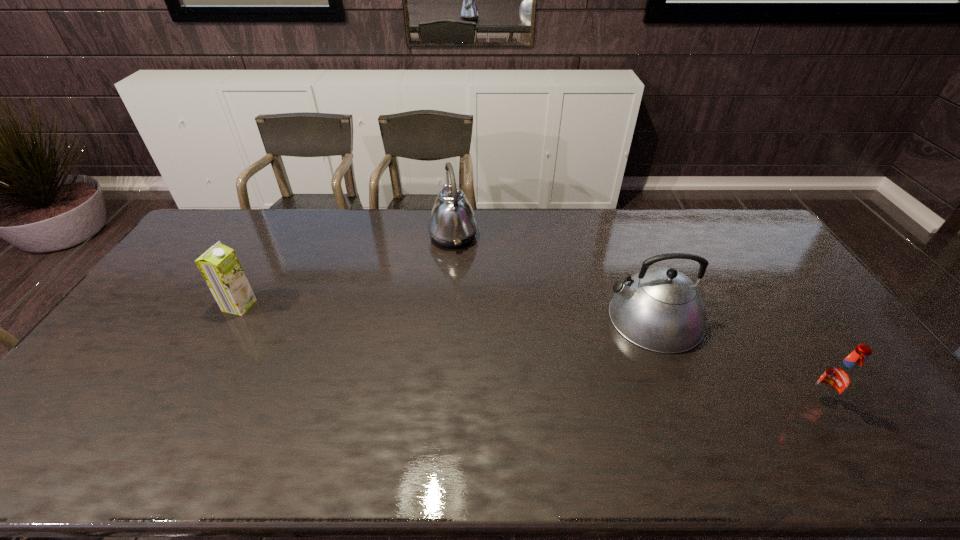
Locate an element on the screen. This screenshot has width=960, height=540. free space in the image that satisfies the following two spatial constraints: 1. on the back side of the rightmost object; 2. from the spout of the nearer kettle is located at coordinates (764, 318).